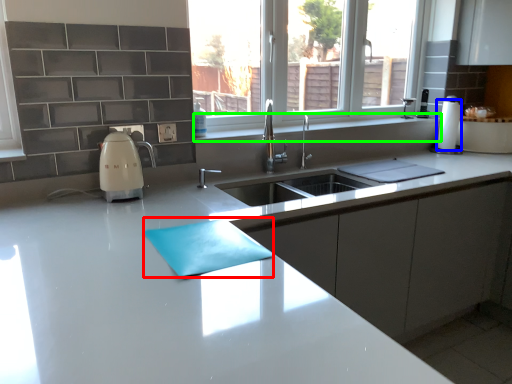
Question: Which is farther away from place mat (highlighted by a red box)? paper towel (highlighted by a blue box) or window sill (highlighted by a green box)?

Choices:
 (A) paper towel
 (B) window sill

Answer: (A)